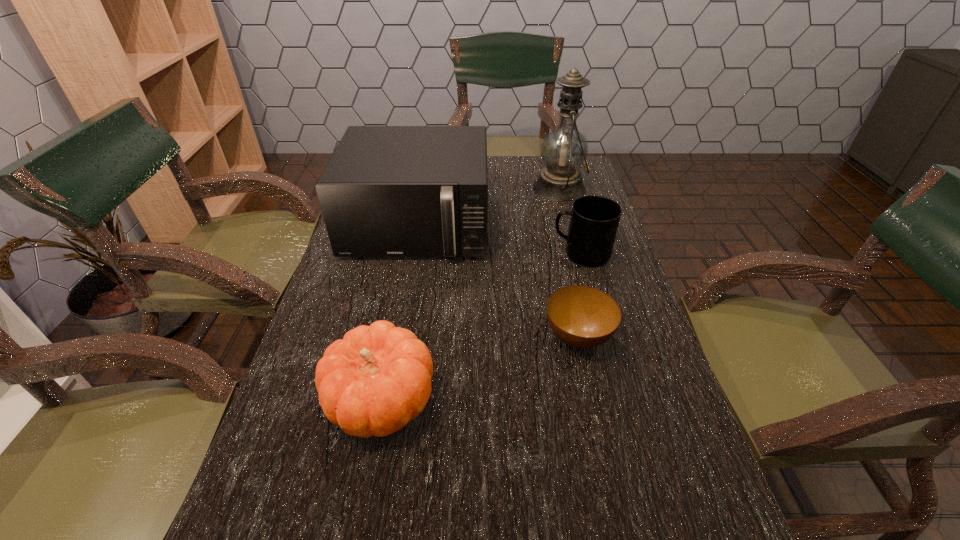
The image size is (960, 540). In order to click on free region at the left edge of the desktop in this screenshot , I will do `click(366, 295)`.

This screenshot has width=960, height=540. In the image, there is a desktop. In order to click on vacant space at the right edge in this screenshot , I will do `click(622, 446)`.

The image size is (960, 540). In order to click on empty space between the tallest object and the pumpkin in this screenshot , I will do `click(470, 295)`.

Locate an element on the screen. free space between the tallest object and the shortest object is located at coordinates (568, 263).

Identify the location of vacant space that is in between the bowl and the tallest object. (568, 263).

You are a GUI agent. You are given a task and a screenshot of the screen. Output one action in this format:
    pyautogui.click(x=<x>, y=<y>)
    Task: Click on the empty space that is in between the shortest object and the pumpkin
    
    Given the screenshot: What is the action you would take?
    pyautogui.click(x=479, y=369)

Locate an element on the screen. Image resolution: width=960 pixels, height=540 pixels. vacant area that lies between the pumpkin and the mug is located at coordinates (481, 328).

The height and width of the screenshot is (540, 960). I want to click on vacant region between the mug and the microwave oven, so click(499, 240).

Locate an element on the screen. This screenshot has width=960, height=540. free spot between the pumpkin and the tallest object is located at coordinates (470, 295).

Image resolution: width=960 pixels, height=540 pixels. I want to click on the closest object to the oil lamp, so click(x=388, y=191).